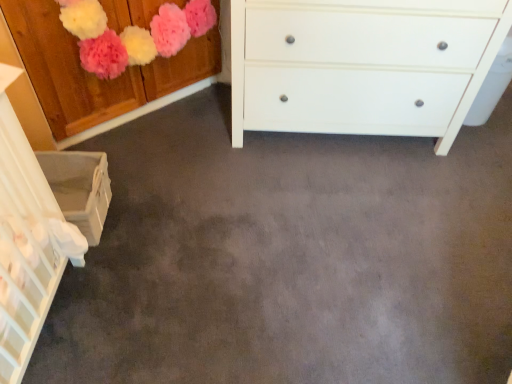
Question: Considering the relative positions of wooden cabinet at upper left, the 1th cabinetry positioned from the top, and white woven basket at lower left, which is the 2th cabinetry from top to bottom, in the image provided, is wooden cabinet at upper left, the 1th cabinetry positioned from the top, to the left of white woven basket at lower left, which is the 2th cabinetry from top to bottom, from the viewer's perspective?

Choices:
 (A) no
 (B) yes

Answer: (A)

Question: Is wooden cabinet at upper left, the 1th cabinetry positioned from the top, completely or partially outside of white woven basket at lower left, which is the 2th cabinetry from top to bottom?

Choices:
 (A) no
 (B) yes

Answer: (B)

Question: Is wooden cabinet at upper left, the 1th cabinetry positioned from the top, looking in the opposite direction of white woven basket at lower left, the 1th cabinetry ordered from the bottom?

Choices:
 (A) no
 (B) yes

Answer: (A)

Question: Considering the relative positions of wooden cabinet at upper left, the second cabinetry in the bottom-to-top sequence, and white woven basket at lower left, which is the 2th cabinetry from top to bottom, in the image provided, is wooden cabinet at upper left, the second cabinetry in the bottom-to-top sequence, to the right of white woven basket at lower left, which is the 2th cabinetry from top to bottom, from the viewer's perspective?

Choices:
 (A) yes
 (B) no

Answer: (A)

Question: Can white woven basket at lower left, which is the 2th cabinetry from top to bottom, be found inside wooden cabinet at upper left, the second cabinetry in the bottom-to-top sequence?

Choices:
 (A) no
 (B) yes

Answer: (A)

Question: From a real-world perspective, relative to white woven basket at lower left, which is the 2th cabinetry from top to bottom, is white matte chest of drawers at center vertically above or below?

Choices:
 (A) above
 (B) below

Answer: (A)

Question: Would you say white matte chest of drawers at center is to the left or to the right of white woven basket at lower left, which is the 2th cabinetry from top to bottom, in the picture?

Choices:
 (A) left
 (B) right

Answer: (B)

Question: Considering the positions of white matte chest of drawers at center and white woven basket at lower left, the 1th cabinetry ordered from the bottom, in the image, is white matte chest of drawers at center taller or shorter than white woven basket at lower left, the 1th cabinetry ordered from the bottom,?

Choices:
 (A) short
 (B) tall

Answer: (B)

Question: From the image's perspective, relative to white woven basket at lower left, which is the 2th cabinetry from top to bottom, is white matte chest of drawers at center above or below?

Choices:
 (A) above
 (B) below

Answer: (A)

Question: Considering the relative positions of white woven basket at lower left, the 1th cabinetry ordered from the bottom, and white matte chest of drawers at center in the image provided, is white woven basket at lower left, the 1th cabinetry ordered from the bottom, to the left or to the right of white matte chest of drawers at center?

Choices:
 (A) left
 (B) right

Answer: (A)

Question: Looking at their shapes, would you say white woven basket at lower left, the 1th cabinetry ordered from the bottom, is wider or thinner than white matte chest of drawers at center?

Choices:
 (A) thin
 (B) wide

Answer: (A)

Question: Is white woven basket at lower left, which is the 2th cabinetry from top to bottom, inside the boundaries of white matte chest of drawers at center, or outside?

Choices:
 (A) outside
 (B) inside

Answer: (A)

Question: Considering the positions of white woven basket at lower left, the 1th cabinetry ordered from the bottom, and white matte chest of drawers at center in the image, is white woven basket at lower left, the 1th cabinetry ordered from the bottom, taller or shorter than white matte chest of drawers at center?

Choices:
 (A) tall
 (B) short

Answer: (B)

Question: Is white matte chest of drawers at center wider or thinner than wooden cabinet at upper left, the second cabinetry in the bottom-to-top sequence?

Choices:
 (A) thin
 (B) wide

Answer: (B)

Question: From the image's perspective, is white matte chest of drawers at center located above or below wooden cabinet at upper left, the second cabinetry in the bottom-to-top sequence?

Choices:
 (A) above
 (B) below

Answer: (B)